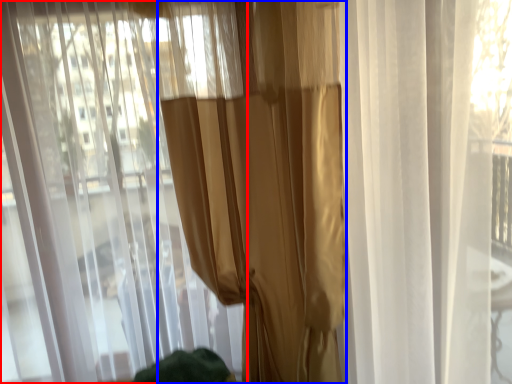
Question: Which point is further to the camera, curtain (highlighted by a red box) or curtain (highlighted by a blue box)?

Choices:
 (A) curtain
 (B) curtain

Answer: (B)